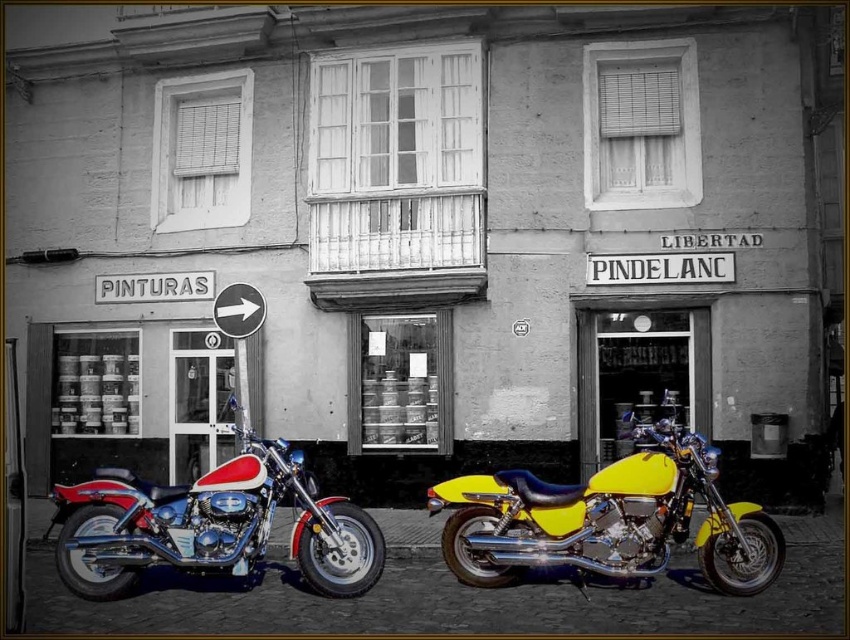
You are a delivery person who needs to park your motorcycle in a spot that is exactly at the center of the image. The scene shows a yellow shiny motorcycle at center. Is the point marked by the coordinates point (609,518) the correct location for your motorcycle?

Yes, the point (609,518) marks the yellow shiny motorcycle at center, so the delivery person should park their motorcycle there.

You are a delivery person who needs to load a large package onto the motorcycles. The package requires the motorcycle to have a minimum height clearance of 1.5 meters. Which motorcycle between the yellow shiny motorcycle at center and the shiny chrome motorcycle at center can accommodate the package?

The yellow shiny motorcycle at center has a greater height compared to the shiny chrome motorcycle at center. Therefore, the yellow shiny motorcycle at center can accommodate the large package requiring a minimum height clearance of 1.5 meters, provided its height meets or exceeds the requirement.